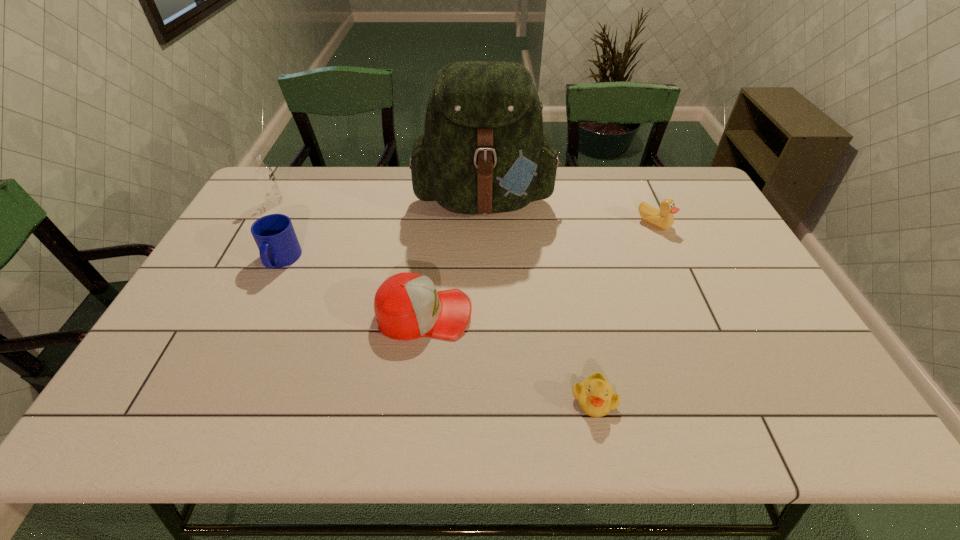
The width and height of the screenshot is (960, 540). I want to click on the tallest object, so click(x=483, y=151).

Identify the location of the fifth shortest object. The height and width of the screenshot is (540, 960). (264, 174).

Image resolution: width=960 pixels, height=540 pixels. What are the coordinates of `the leftmost object` in the screenshot? It's located at (264, 174).

This screenshot has height=540, width=960. What are the coordinates of `the fifth object from right to left` in the screenshot? It's located at (278, 245).

You are a GUI agent. You are given a task and a screenshot of the screen. Output one action in this format:
    pyautogui.click(x=<x>, y=<y>)
    Task: Click on the third nearest object
    This screenshot has width=960, height=540.
    Given the screenshot: What is the action you would take?
    pyautogui.click(x=278, y=245)

This screenshot has height=540, width=960. In order to click on the fifth farthest object in this screenshot , I will do `click(407, 306)`.

Identify the location of duck. The height and width of the screenshot is (540, 960). (664, 219).

Locate an element on the screen. This screenshot has height=540, width=960. the nearest object is located at coordinates (595, 396).

You are a GUI agent. You are given a task and a screenshot of the screen. Output one action in this format:
    pyautogui.click(x=<x>, y=<y>)
    Task: Click on the duckling
    This screenshot has height=540, width=960.
    Given the screenshot: What is the action you would take?
    pyautogui.click(x=595, y=396)

At what (x,y) coordinates should I click in order to perform the action: click on vacant space located 0.330m on the open flap of the backpack. Please return your answer as a coordinate pair (x, y). The image size is (960, 540). Looking at the image, I should click on (487, 321).